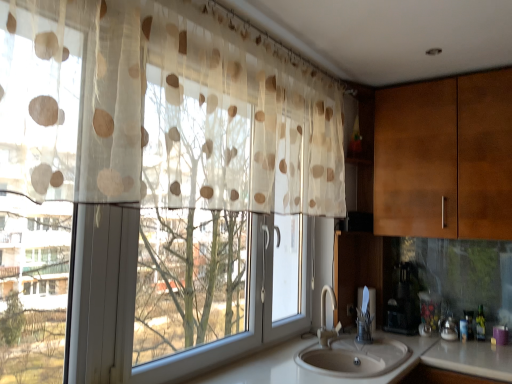
Question: From a real-world perspective, is black plastic coffee maker at lower right positioned over translucent beige polka dot curtain at left based on gravity?

Choices:
 (A) no
 (B) yes

Answer: (A)

Question: Can you confirm if black plastic coffee maker at lower right is bigger than translucent beige polka dot curtain at left?

Choices:
 (A) no
 (B) yes

Answer: (A)

Question: Considering the relative positions of black plastic coffee maker at lower right and translucent beige polka dot curtain at left in the image provided, is black plastic coffee maker at lower right behind translucent beige polka dot curtain at left?

Choices:
 (A) no
 (B) yes

Answer: (B)

Question: Considering the relative positions of black plastic coffee maker at lower right and translucent beige polka dot curtain at left in the image provided, is black plastic coffee maker at lower right to the left of translucent beige polka dot curtain at left from the viewer's perspective?

Choices:
 (A) no
 (B) yes

Answer: (A)

Question: Would you consider black plastic coffee maker at lower right to be distant from translucent beige polka dot curtain at left?

Choices:
 (A) yes
 (B) no

Answer: (A)

Question: In the image, is translucent beige polka dot curtain at left positioned in front of or behind white glossy counter top at lower center?

Choices:
 (A) behind
 (B) front

Answer: (B)

Question: Is point (158, 59) closer or farther from the camera than point (282, 347)?

Choices:
 (A) farther
 (B) closer

Answer: (B)

Question: Is translucent beige polka dot curtain at left spatially inside white glossy counter top at lower center, or outside of it?

Choices:
 (A) outside
 (B) inside

Answer: (A)

Question: Considering the positions of translucent beige polka dot curtain at left and white glossy counter top at lower center in the image, is translucent beige polka dot curtain at left wider or thinner than white glossy counter top at lower center?

Choices:
 (A) thin
 (B) wide

Answer: (A)

Question: Would you say translucent beige polka dot curtain at left is inside or outside wooden cabinet at right?

Choices:
 (A) outside
 (B) inside

Answer: (A)

Question: From a real-world perspective, is translucent beige polka dot curtain at left positioned above or below wooden cabinet at right?

Choices:
 (A) below
 (B) above

Answer: (B)

Question: In the image, is translucent beige polka dot curtain at left positioned in front of or behind wooden cabinet at right?

Choices:
 (A) behind
 (B) front

Answer: (B)

Question: In terms of width, does translucent beige polka dot curtain at left look wider or thinner when compared to wooden cabinet at right?

Choices:
 (A) wide
 (B) thin

Answer: (B)

Question: Considering the positions of translucent plastic bottle at sink right and wooden cabinet at right in the image, is translucent plastic bottle at sink right taller or shorter than wooden cabinet at right?

Choices:
 (A) short
 (B) tall

Answer: (A)

Question: Considering their positions, is translucent plastic bottle at sink right located in front of or behind wooden cabinet at right?

Choices:
 (A) front
 (B) behind

Answer: (B)